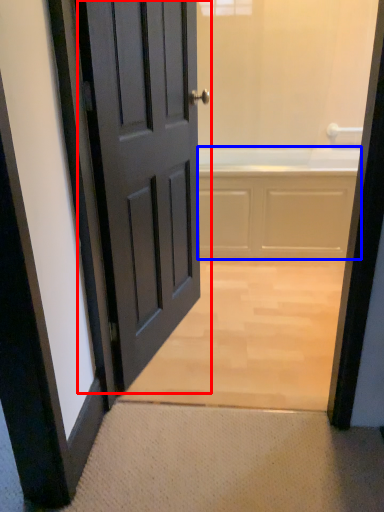
Question: Which point is closer to the camera, door (highlighted by a red box) or bath (highlighted by a blue box)?

Choices:
 (A) door
 (B) bath

Answer: (A)